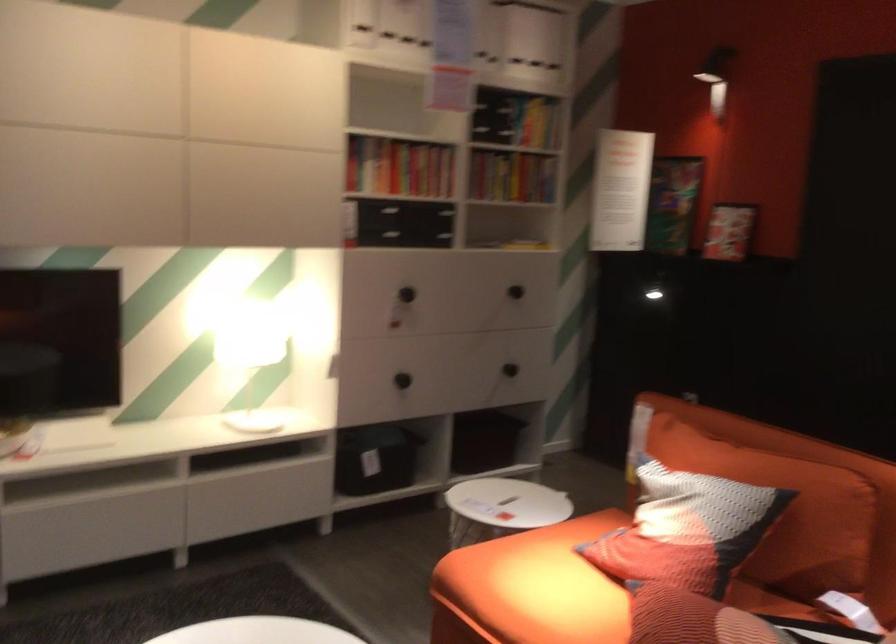
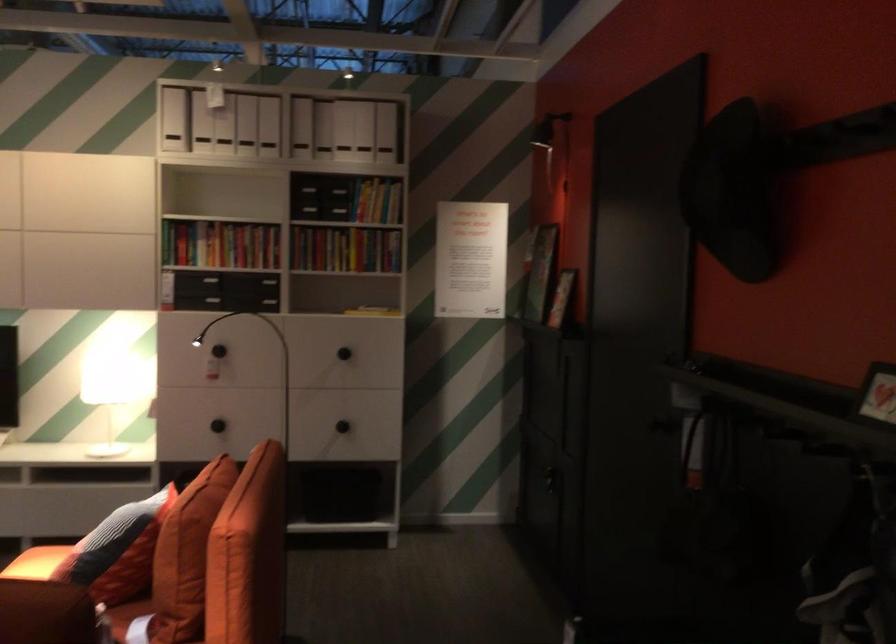
The point at (553, 234) is marked in the first image. Where is the corresponding point in the second image?

(372, 310)